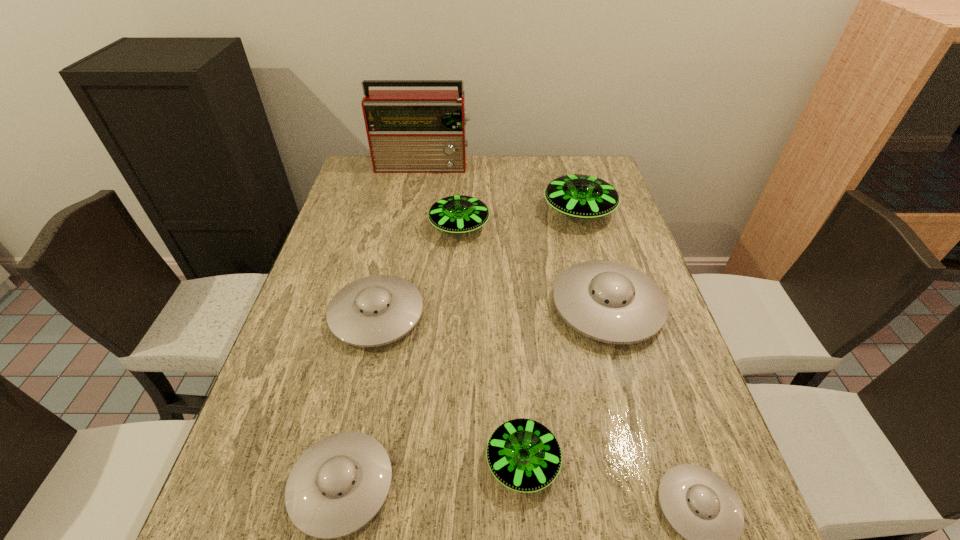
Locate an element on the screen. The width and height of the screenshot is (960, 540). vacant space that satisfies the following two spatial constraints: 1. on the front-facing side of the radio receiver; 2. on the left side of the smallest green saucer is located at coordinates (371, 462).

Image resolution: width=960 pixels, height=540 pixels. What are the coordinates of `vacant space that satisfies the following two spatial constraints: 1. on the back side of the biggest gray saucer; 2. on the right side of the smallest green saucer` in the screenshot? It's located at (512, 307).